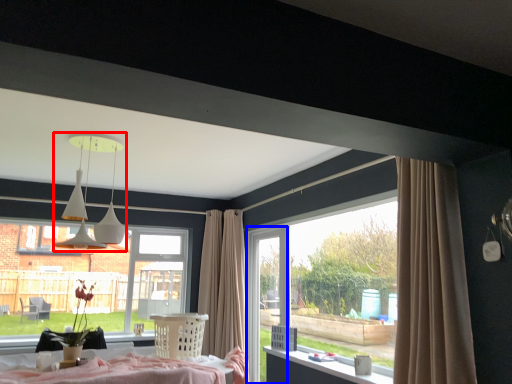
Question: Which point is further to the camera, lamp (highlighted by a red box) or screen door (highlighted by a blue box)?

Choices:
 (A) lamp
 (B) screen door

Answer: (B)